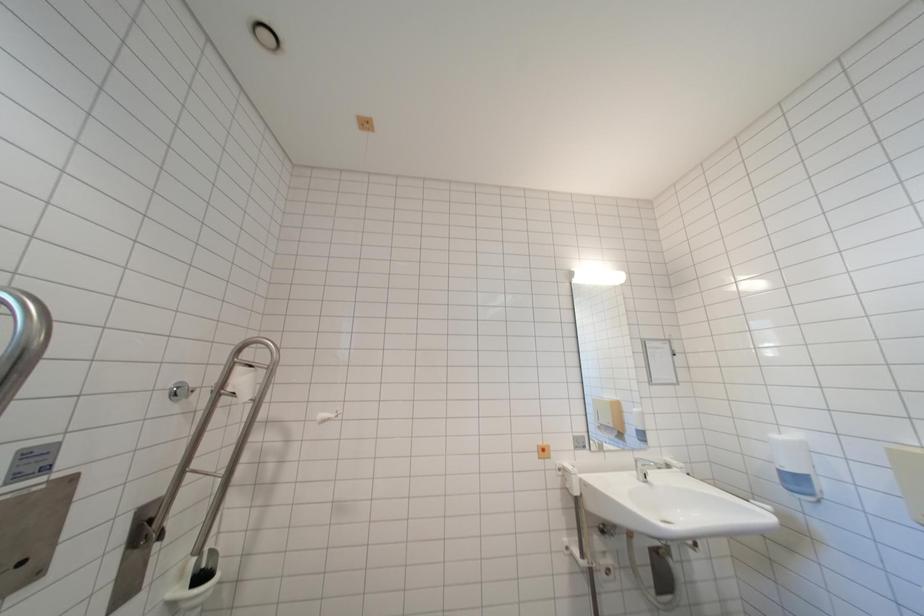
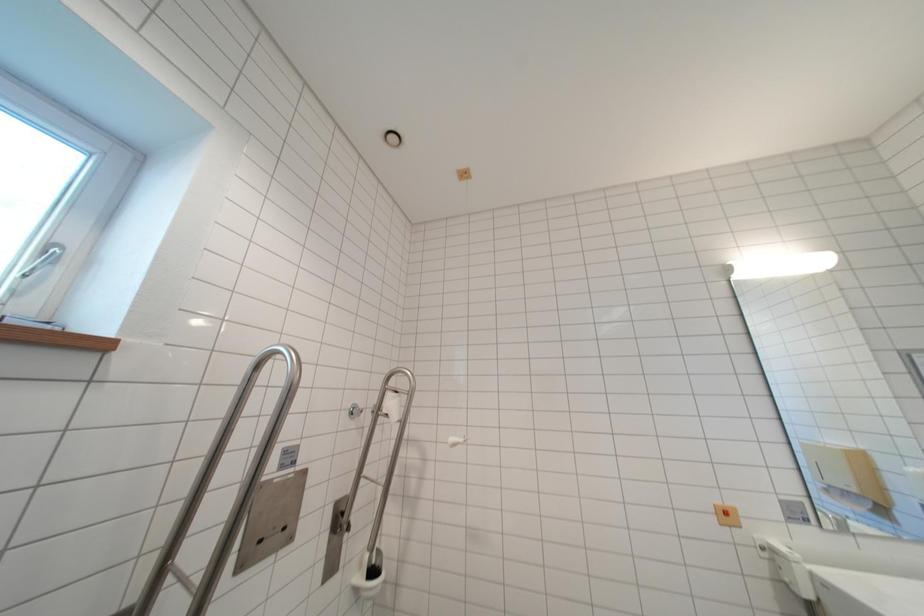
Question: How did the camera likely rotate?

Choices:
 (A) Left
 (B) Right
 (C) Up
 (D) Down

Answer: (A)